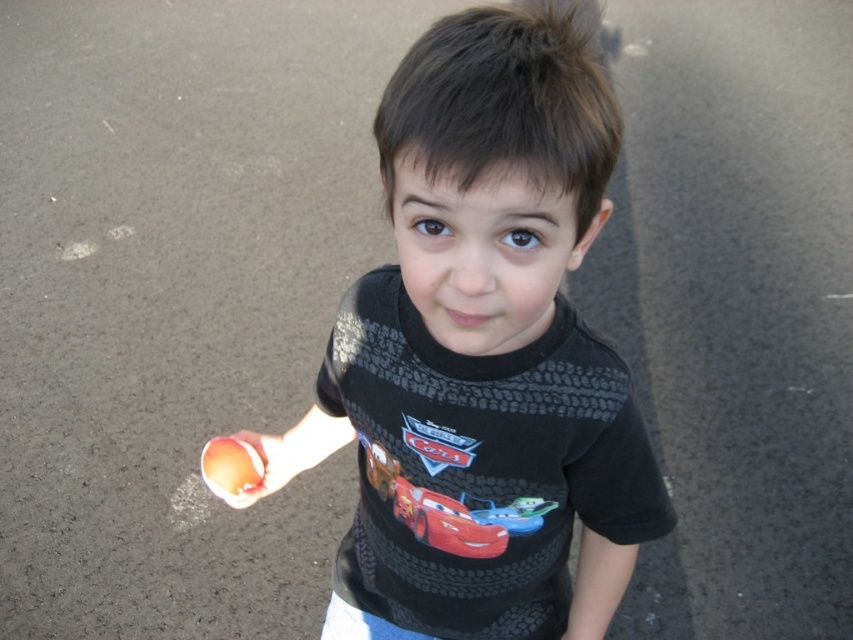
The child is holding a shiny red toy car at center in one hand and wearing a black matte shirt at center. If the shirt is wider than the toy car, which item has a larger width?

The black matte shirt at center has a larger width than the shiny red toy car at center according to the description provided.

You are a photographer standing in front of the child. You need to place two markers on the ground at the given points to mark where the child should stand for the next photoshoot. The first marker is at point (595, 554) and the second at point (242, 492). Which point is closer to you?

Point (595, 554) is closer to the viewer than point (242, 492).